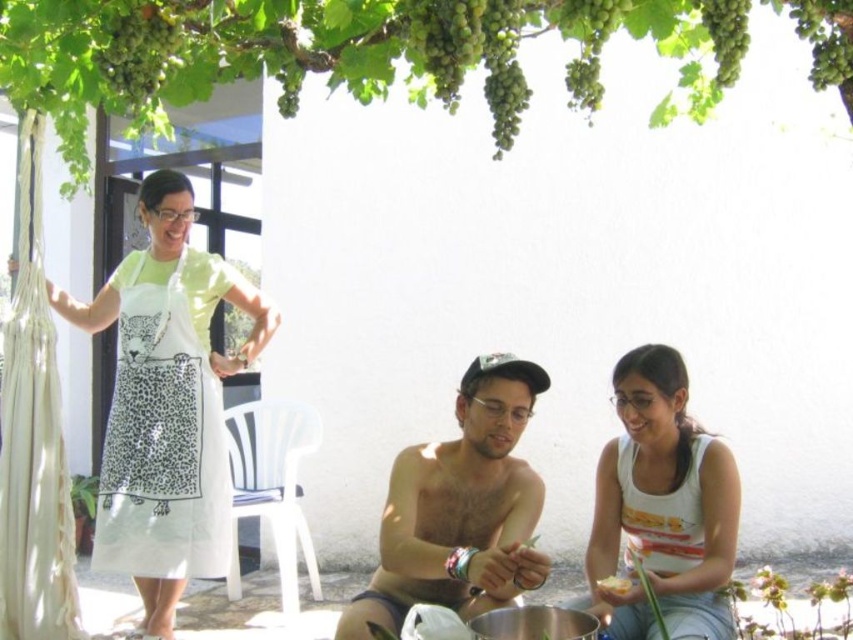
You are organizing a picnic and need to pack items. You have a shiny metallic cap at center and a white cotton tank top at center. Which item should you choose if you want to carry the one that takes up more space?

The shiny metallic cap at center has a larger size compared to the white cotton tank top at center, so you should choose the shiny metallic cap at center as it takes up more space.

You are a photographer setting up a shoot in this outdoor scene. You notice the shiny metallic cap at center and the white cotton tank top at center. Which object has a greater width when viewed from your position?

The shiny metallic cap at center has a greater width than the white cotton tank top at center.

You are standing in the center of the patio and want to take a photo of the green leafy tree at upper center. According to the coordinates provided, where should you position your camera to capture the tree in the frame?

The green leafy tree at upper center is located at coordinates 0.084 on the x axis and 0.441 on the y axis, so you should position your camera to aim towards the upper left area of the frame to capture it.